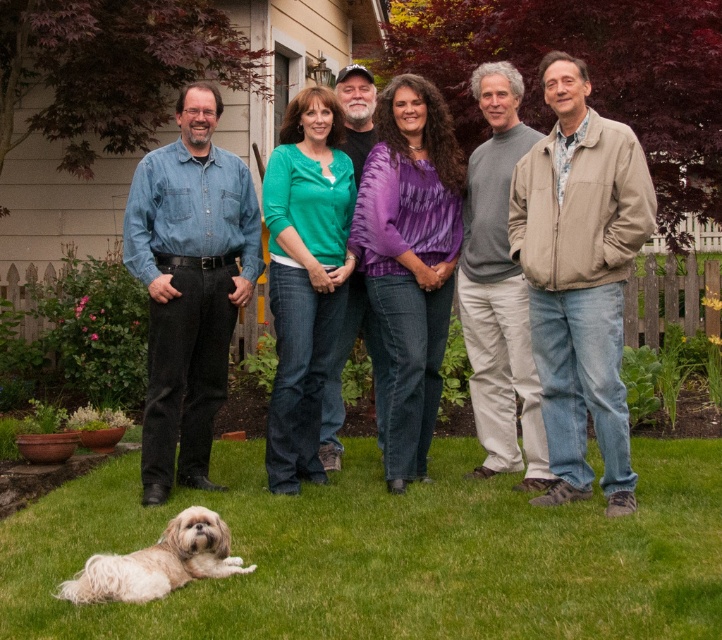
Question: Which object is closer to the camera taking this photo?

Choices:
 (A) tan suede jacket at right
 (B) green denim jeans at center
 (C) purple tie-dye shirt at center

Answer: (A)

Question: Which point is farther to the camera?

Choices:
 (A) purple tie-dye shirt at center
 (B) denim shirt at center

Answer: (A)

Question: From the image, what is the correct spatial relationship of purple tie-dye shirt at center in relation to white fluffy dog at lower left?

Choices:
 (A) right
 (B) left

Answer: (A)

Question: Is tan suede jacket at right below purple tie-dye shirt at center?

Choices:
 (A) no
 (B) yes

Answer: (A)

Question: Among these objects, which one is nearest to the camera?

Choices:
 (A) denim shirt at center
 (B) green denim jeans at center

Answer: (A)

Question: Is the position of denim shirt at center more distant than that of purple tie-dye shirt at center?

Choices:
 (A) yes
 (B) no

Answer: (B)